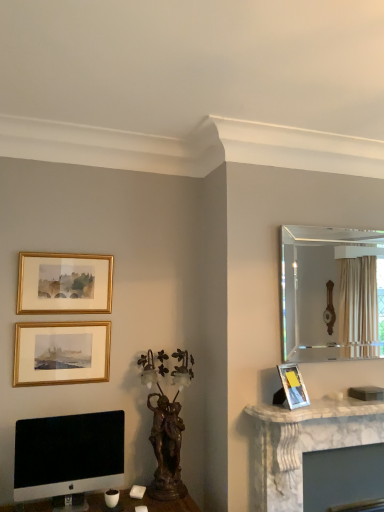
Question: Is white marble fireplace at right spatially inside white marble fireplace at right, or outside of it?

Choices:
 (A) inside
 (B) outside

Answer: (B)

Question: Is point (269, 480) closer or farther from the camera than point (370, 408)?

Choices:
 (A) farther
 (B) closer

Answer: (B)

Question: Which is farther from the gold framed picture at upper left, the 2th picture frame from the left?

Choices:
 (A) bronze/bronzed sculpture at center
 (B) matte silver picture frame at right, the 1th picture frame viewed from the right
 (C) sleek silver monitor at lower left
 (D) clear glass mirror at upper right
 (E) white marble fireplace at right

Answer: (D)

Question: Which of these objects is positioned farthest from the matte silver picture frame at right, arranged as the third picture frame when viewed from the top?

Choices:
 (A) clear glass mirror at upper right
 (B) white marble fireplace at right
 (C) bronze/bronzed sculpture at center
 (D) gold-framed picture at upper left, which is the 2th picture frame in top-to-bottom order
 (E) white marble fireplace at right

Answer: (A)